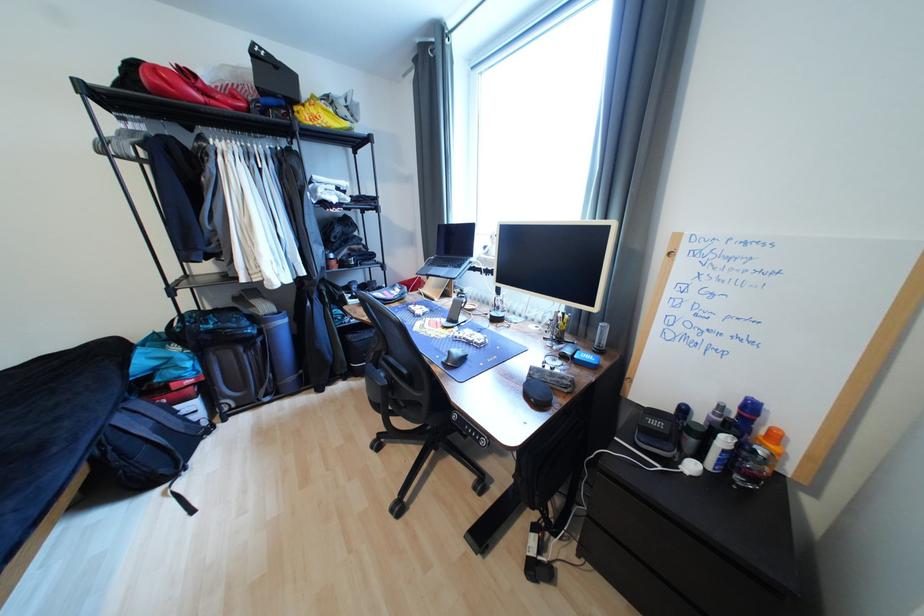
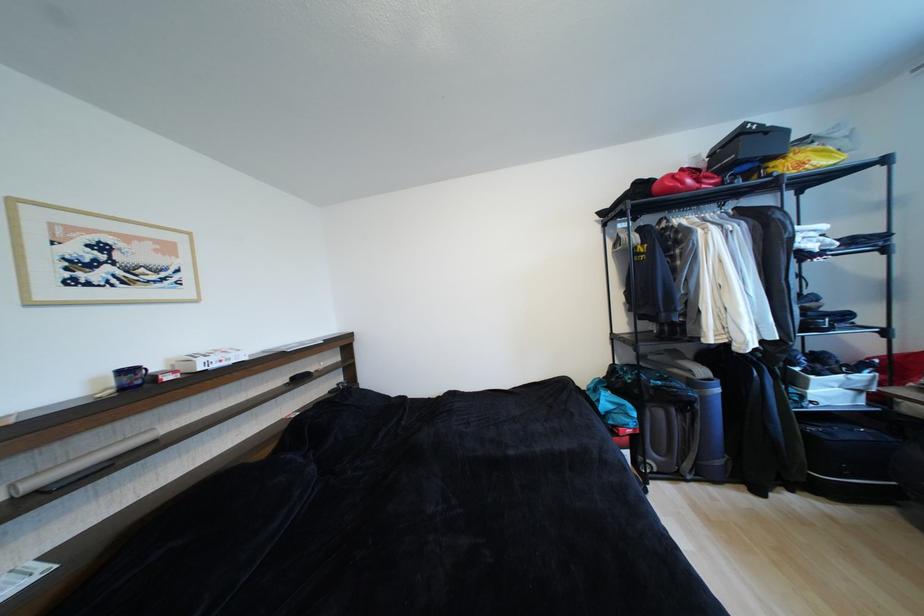
Locate, in the second image, the point that corresponds to pixel 167 92 in the first image.

(676, 192)